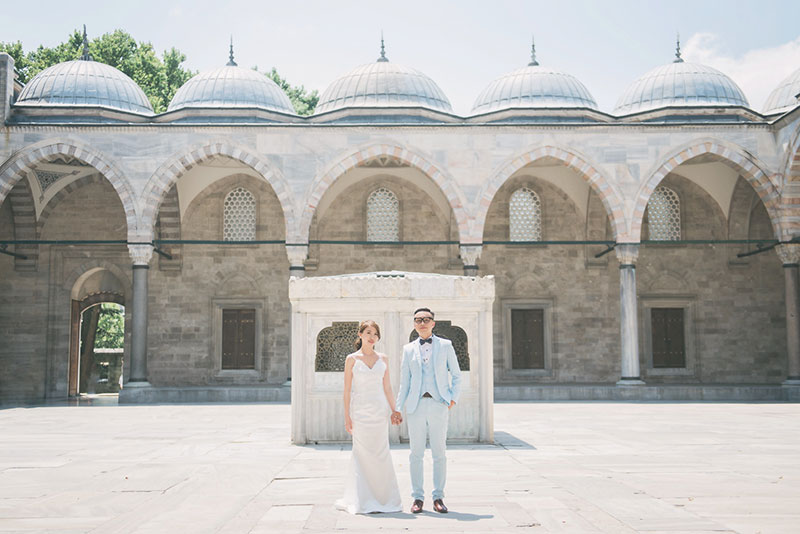
Identify the location of columns. (300, 264), (470, 270), (636, 354), (794, 321), (137, 348).